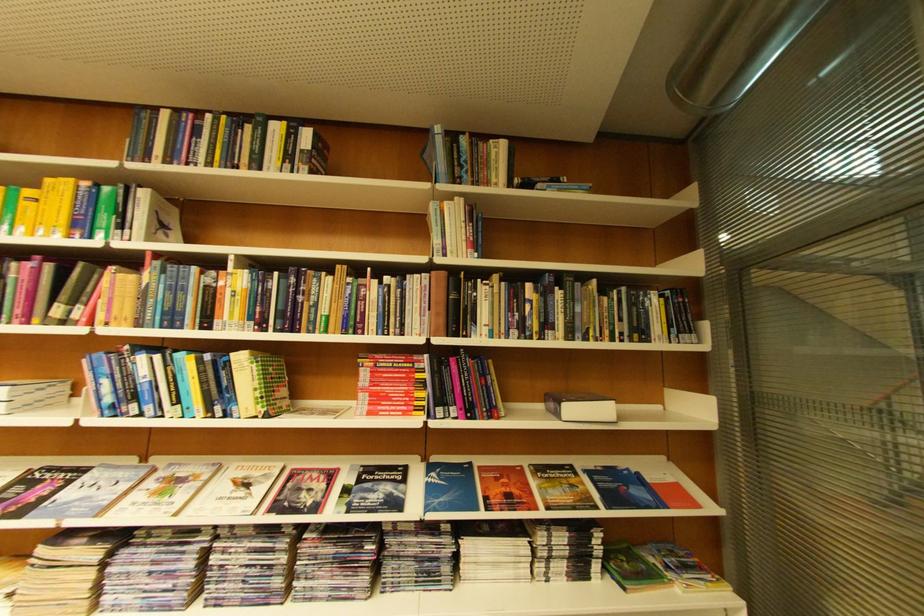
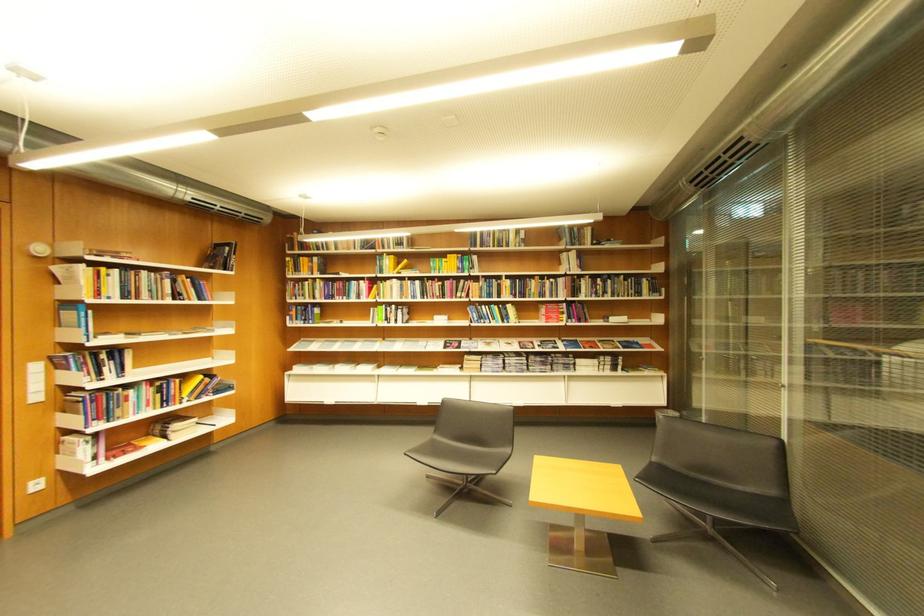
Question: What movement of the cameraman would produce the second image?

Choices:
 (A) Left
 (B) Right
 (C) Forward
 (D) Backward

Answer: (D)